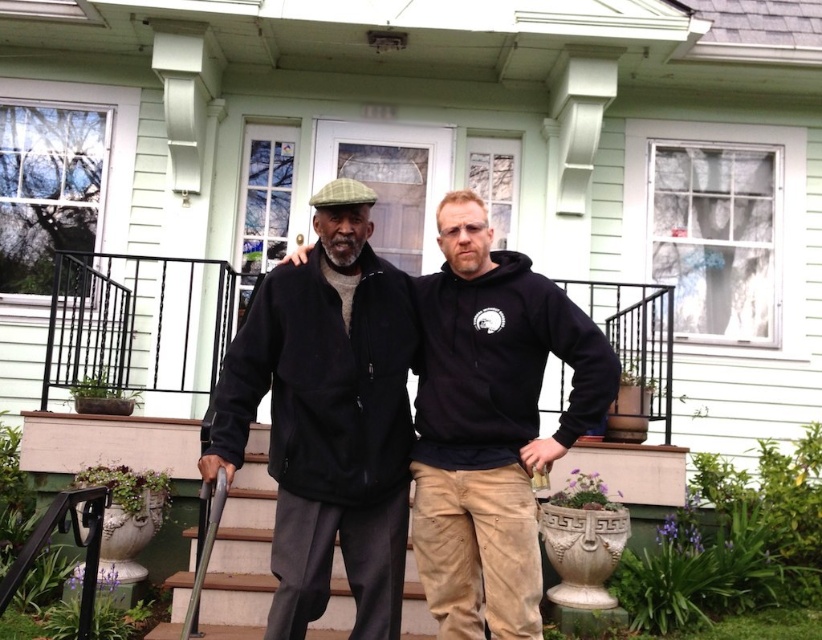
Does point (331, 388) lie in front of point (650, 339)?

That is True.

Who is more forward, (330, 289) or (112, 381)?

Positioned in front is point (330, 289).

In order to click on black fleece sweatshirt at center in this screenshot , I will do (324, 381).

From the picture: Which is below, black hoodie at center or white painted wood stairs at center?

Positioned lower is white painted wood stairs at center.

Is black hoodie at center positioned behind white painted wood stairs at center?

No, black hoodie at center is closer to the viewer.

Who is more distant from viewer, [485,465] or [262,577]?

The point [262,577] is behind.

Find the location of a particular element. black hoodie at center is located at coordinates (492, 422).

Is black matte jacket at center wider than white painted wood stairs at center?

Yes, black matte jacket at center is wider than white painted wood stairs at center.

In the scene shown: Is black matte jacket at center to the right of white painted wood stairs at center from the viewer's perspective?

Indeed, black matte jacket at center is positioned on the right side of white painted wood stairs at center.

Locate an element on the screen. black matte jacket at center is located at coordinates (492, 422).